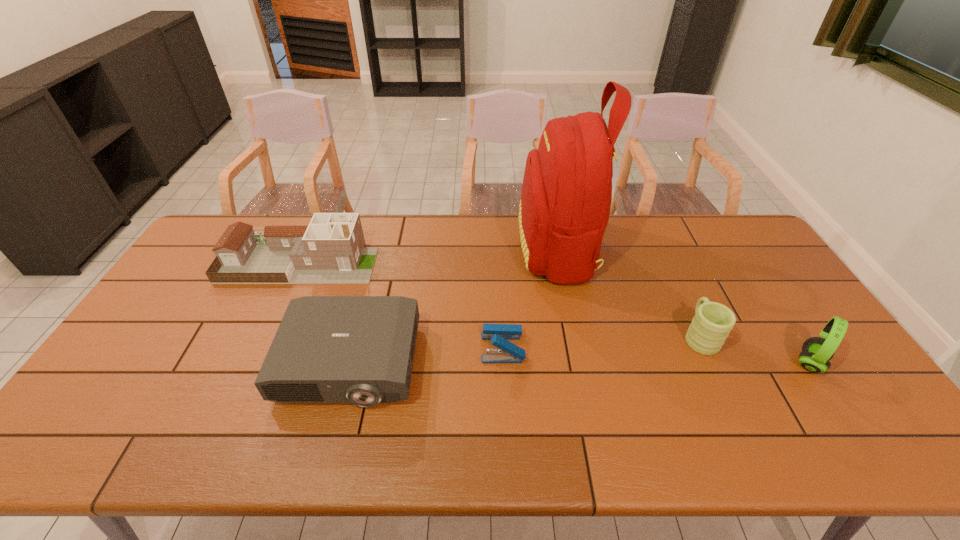
Find the location of a particular element. This screenshot has width=960, height=540. free space in the image that satisfies the following two spatial constraints: 1. on the front-facing side of the backpack; 2. on the front-facing side of the projector is located at coordinates (580, 363).

The image size is (960, 540). I want to click on free spot that satisfies the following two spatial constraints: 1. on the front side of the third object from left to right; 2. on the right side of the headset, so click(503, 363).

The height and width of the screenshot is (540, 960). I want to click on vacant space that satisfies the following two spatial constraints: 1. at the main entrance of the dollhouse; 2. on the left side of the rightmost object, so click(x=253, y=363).

The image size is (960, 540). I want to click on free space that satisfies the following two spatial constraints: 1. at the main entrance of the headset; 2. on the right side of the dollhouse, so click(x=253, y=363).

The image size is (960, 540). I want to click on free space that satisfies the following two spatial constraints: 1. on the front-facing side of the tallest object; 2. on the front-facing side of the projector, so click(x=580, y=363).

You are a GUI agent. You are given a task and a screenshot of the screen. Output one action in this format:
    pyautogui.click(x=<x>, y=<y>)
    Task: Click on the free point that satisfies the following two spatial constraints: 1. at the main entrance of the shortest object; 2. on the left side of the dollhouse
    The width and height of the screenshot is (960, 540).
    Given the screenshot: What is the action you would take?
    pyautogui.click(x=260, y=348)

Where is `blank area in the image that satisfies the following two spatial constraints: 1. at the main entrance of the dollhouse; 2. on the right side of the headset`? blank area in the image that satisfies the following two spatial constraints: 1. at the main entrance of the dollhouse; 2. on the right side of the headset is located at coordinates (253, 363).